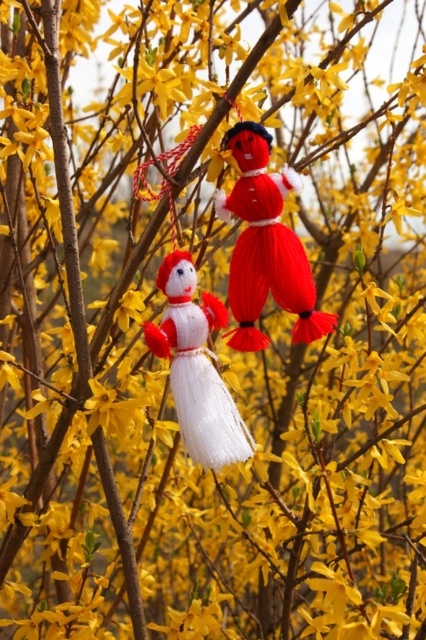
Question: Is knitted woolen doll at center to the right of white yarn snowman at center from the viewer's perspective?

Choices:
 (A) yes
 (B) no

Answer: (A)

Question: Which point is farther to the camera?

Choices:
 (A) (184, 368)
 (B) (259, 268)

Answer: (A)

Question: Among these objects, which one is nearest to the camera?

Choices:
 (A) white yarn snowman at center
 (B) knitted woolen doll at center

Answer: (A)

Question: Which of the following is the closest to the observer?

Choices:
 (A) knitted woolen doll at center
 (B) white yarn snowman at center

Answer: (B)

Question: In this image, where is knitted woolen doll at center located relative to white yarn snowman at center?

Choices:
 (A) below
 (B) above

Answer: (B)

Question: Observing the image, what is the correct spatial positioning of knitted woolen doll at center in reference to white yarn snowman at center?

Choices:
 (A) right
 (B) left

Answer: (A)